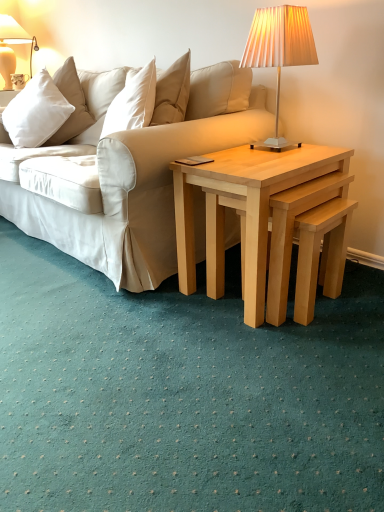
What do you see at coordinates (11, 47) in the screenshot?
I see `matte white lampshade at upper left, which is counted as the second lamp, starting from the bottom` at bounding box center [11, 47].

What do you see at coordinates (36, 112) in the screenshot?
I see `white soft cushion at upper left` at bounding box center [36, 112].

The width and height of the screenshot is (384, 512). Identify the location of matte cream lampshade at upper right, positioned as the 1th lamp in right-to-left order. (279, 48).

Between white soft cushion at upper left and matte cream lampshade at upper right, the second lamp viewed from the top, which one has larger size?

With larger size is white soft cushion at upper left.

Is white soft cushion at upper left closer to camera compared to matte cream lampshade at upper right, the second lamp viewed from the top?

No, the depth of white soft cushion at upper left is greater than that of matte cream lampshade at upper right, the second lamp viewed from the top.

Can you confirm if white soft cushion at upper left is shorter than matte cream lampshade at upper right, the 1th lamp viewed from the front?

Correct, white soft cushion at upper left is not as tall as matte cream lampshade at upper right, the 1th lamp viewed from the front.

Choose the correct answer: Is matte white lampshade at upper left, the 1th lamp when ordered from back to front, inside light wood/natural wood nesting tables at center or outside it?

matte white lampshade at upper left, the 1th lamp when ordered from back to front, is spatially situated outside light wood/natural wood nesting tables at center.

Which object is further away from the camera taking this photo, matte white lampshade at upper left, the 2th lamp viewed from the right, or light wood/natural wood nesting tables at center?

matte white lampshade at upper left, the 2th lamp viewed from the right.

Between matte white lampshade at upper left, the 1th lamp when ordered from back to front, and light wood/natural wood nesting tables at center, which one appears on the left side from the viewer's perspective?

matte white lampshade at upper left, the 1th lamp when ordered from back to front, is more to the left.

Between matte cream lampshade at upper right, marked as the 2th lamp in a left-to-right arrangement, and white soft cushion at upper left, which one has smaller width?

With smaller width is matte cream lampshade at upper right, marked as the 2th lamp in a left-to-right arrangement.

Considering the relative positions of matte cream lampshade at upper right, marked as the 2th lamp in a left-to-right arrangement, and white soft cushion at upper left in the image provided, is matte cream lampshade at upper right, marked as the 2th lamp in a left-to-right arrangement, to the left or to the right of white soft cushion at upper left?

From the image, it's evident that matte cream lampshade at upper right, marked as the 2th lamp in a left-to-right arrangement, is to the right of white soft cushion at upper left.

Is matte cream lampshade at upper right, the 1th lamp viewed from the front, bigger than white soft cushion at upper left?

No.

Based on the photo, is matte cream lampshade at upper right, marked as the 2th lamp in a left-to-right arrangement, far from white soft cushion at upper left?

matte cream lampshade at upper right, marked as the 2th lamp in a left-to-right arrangement, is positioned a significant distance from white soft cushion at upper left.

How different are the orientations of matte white lampshade at upper left, the 2th lamp viewed from the right, and matte cream lampshade at upper right, placed as the second lamp when sorted from back to front, in degrees?

They differ by 2.76 degrees in their facing directions.

From a real-world perspective, which is physically above, matte white lampshade at upper left, the 2th lamp viewed from the right, or matte cream lampshade at upper right, the 1th lamp viewed from the front?

In real-world perspective, matte white lampshade at upper left, the 2th lamp viewed from the right, is above.

The image size is (384, 512). I want to click on lamp in front of the matte white lampshade at upper left, the 2th lamp viewed from the right, so click(279, 48).

From the picture: Is matte white lampshade at upper left, arranged as the 1th lamp when viewed from the top, directly adjacent to matte cream lampshade at upper right, positioned as the 1th lamp in right-to-left order?

matte white lampshade at upper left, arranged as the 1th lamp when viewed from the top, and matte cream lampshade at upper right, positioned as the 1th lamp in right-to-left order, are clearly separated.

From a real-world perspective, is light wood/natural wood nesting tables at center above or below matte cream lampshade at upper right, the 1th lamp viewed from the front?

light wood/natural wood nesting tables at center is below matte cream lampshade at upper right, the 1th lamp viewed from the front.

The image size is (384, 512). What are the coordinates of `lamp that is the 1st one above the light wood/natural wood nesting tables at center (from a real-world perspective)` in the screenshot? It's located at (279, 48).

Which is nearer, [194,185] or [273,16]?

Clearly, point [194,185] is more distant from the camera than point [273,16].

Is light wood/natural wood nesting tables at center to the right of matte cream lampshade at upper right, marked as the 2th lamp in a left-to-right arrangement, from the viewer's perspective?

No.

Is light wood/natural wood nesting tables at center looking in the opposite direction of matte white lampshade at upper left, arranged as the 1th lamp when viewed from the top?

That's not correct — light wood/natural wood nesting tables at center is not looking away from matte white lampshade at upper left, arranged as the 1th lamp when viewed from the top.

Who is smaller, light wood/natural wood nesting tables at center or matte white lampshade at upper left, the 1th lamp when ordered from back to front?

matte white lampshade at upper left, the 1th lamp when ordered from back to front, is smaller.

Is light wood/natural wood nesting tables at center beside matte white lampshade at upper left, the 2th lamp viewed from the right?

No, light wood/natural wood nesting tables at center is not with matte white lampshade at upper left, the 2th lamp viewed from the right.

From a real-world perspective, which object stands above the other?

From a 3D spatial view, matte white lampshade at upper left, arranged as the 1th lamp when viewed from the top, is above.

Does matte cream lampshade at upper right, positioned as the 1th lamp in right-to-left order, turn towards light wood/natural wood nesting tables at center?

No, matte cream lampshade at upper right, positioned as the 1th lamp in right-to-left order, is not turned towards light wood/natural wood nesting tables at center.

How much distance is there between matte cream lampshade at upper right, positioned as the 1th lamp in right-to-left order, and light wood/natural wood nesting tables at center?

matte cream lampshade at upper right, positioned as the 1th lamp in right-to-left order, and light wood/natural wood nesting tables at center are 18.94 inches apart.

Considering the sizes of objects matte cream lampshade at upper right, which ranks as the 1th lamp in bottom-to-top order, and light wood/natural wood nesting tables at center in the image provided, who is shorter, matte cream lampshade at upper right, which ranks as the 1th lamp in bottom-to-top order, or light wood/natural wood nesting tables at center?

With less height is matte cream lampshade at upper right, which ranks as the 1th lamp in bottom-to-top order.

From a real-world perspective, who is located lower, matte cream lampshade at upper right, the second lamp viewed from the top, or light wood/natural wood nesting tables at center?

light wood/natural wood nesting tables at center.

Locate an element on the screen. Image resolution: width=384 pixels, height=512 pixels. the 1st lamp positioned above the white soft cushion at upper left (from a real-world perspective) is located at coordinates (279, 48).

At what (x,y) coordinates should I click in order to perform the action: click on lamp that is the 2nd one when counting upward from the light wood/natural wood nesting tables at center (from the image's perspective). Please return your answer as a coordinate pair (x, y). The width and height of the screenshot is (384, 512). Looking at the image, I should click on (11, 47).

From the image, which object appears to be nearer to matte cream lampshade at upper right, the second lamp viewed from the top, light wood/natural wood nesting tables at center or white soft cushion at upper left?

Based on the image, light wood/natural wood nesting tables at center appears to be nearer to matte cream lampshade at upper right, the second lamp viewed from the top.

Which object lies nearer to the anchor point white soft cushion at upper left, matte white lampshade at upper left, the 2th lamp viewed from the right, or light wood/natural wood nesting tables at center?

light wood/natural wood nesting tables at center.

Considering their positions, is matte white lampshade at upper left, the 2th lamp viewed from the right, positioned further to white soft cushion at upper left than matte cream lampshade at upper right, the second lamp viewed from the top?

matte white lampshade at upper left, the 2th lamp viewed from the right, is positioned further to the anchor white soft cushion at upper left.

Based on their spatial positions, is matte white lampshade at upper left, which is counted as the second lamp, starting from the bottom, or white soft cushion at upper left further from light wood/natural wood nesting tables at center?

The object further to light wood/natural wood nesting tables at center is matte white lampshade at upper left, which is counted as the second lamp, starting from the bottom.

Which object lies further to the anchor point light wood/natural wood nesting tables at center, white soft cushion at upper left or matte white lampshade at upper left, the 1th lamp when ordered from back to front?

Based on the image, matte white lampshade at upper left, the 1th lamp when ordered from back to front, appears to be further to light wood/natural wood nesting tables at center.

Considering their positions, is matte cream lampshade at upper right, which ranks as the 1th lamp in bottom-to-top order, positioned further to matte white lampshade at upper left, positioned as the second lamp in front-to-back order, than white soft cushion at upper left?

The object further to matte white lampshade at upper left, positioned as the second lamp in front-to-back order, is matte cream lampshade at upper right, which ranks as the 1th lamp in bottom-to-top order.

Which object lies further to the anchor point light wood/natural wood nesting tables at center, white soft cushion at upper left or matte cream lampshade at upper right, the second lamp viewed from the top?

white soft cushion at upper left is further to light wood/natural wood nesting tables at center.

Estimate the real-world distances between objects in this image. Which object is closer to matte white lampshade at upper left, which is counted as the second lamp, starting from the bottom, light wood/natural wood nesting tables at center or white soft cushion at upper left?

Based on the image, white soft cushion at upper left appears to be nearer to matte white lampshade at upper left, which is counted as the second lamp, starting from the bottom.

Locate an element on the screen. The image size is (384, 512). pillow between matte white lampshade at upper left, which is counted as the second lamp, starting from the bottom, and matte cream lampshade at upper right, marked as the 2th lamp in a left-to-right arrangement, from left to right is located at coordinates (36, 112).

Locate an element on the screen. pillow between matte white lampshade at upper left, which is counted as the second lamp, starting from the bottom, and light wood/natural wood nesting tables at center, in the horizontal direction is located at coordinates (36, 112).

Identify the location of coffee table between white soft cushion at upper left and matte cream lampshade at upper right, which ranks as the 1th lamp in bottom-to-top order, in the horizontal direction. (246, 204).

The height and width of the screenshot is (512, 384). I want to click on coffee table between matte white lampshade at upper left, which is counted as the second lamp, starting from the bottom, and matte cream lampshade at upper right, the second lamp viewed from the top, from left to right, so click(246, 204).